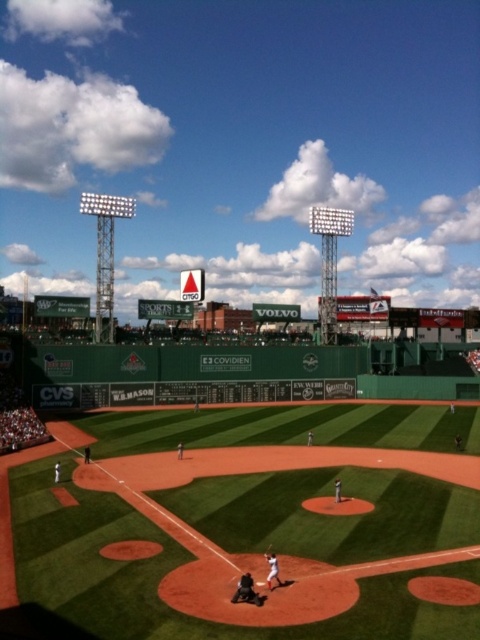
Can you confirm if dark gray fabric catcher at lower center is bigger than white uniform bat at center?

Correct, dark gray fabric catcher at lower center is larger in size than white uniform bat at center.

Is dark gray fabric catcher at lower center above white uniform bat at center?

Actually, dark gray fabric catcher at lower center is below white uniform bat at center.

The image size is (480, 640). I want to click on dark gray fabric catcher at lower center, so click(245, 589).

Find the location of `dark gray fabric catcher at lower center`. dark gray fabric catcher at lower center is located at coordinates (245, 589).

Which is above, white uniform bat at center or wooden bat at home plate?

Positioned higher is white uniform bat at center.

Does white uniform bat at center appear on the right side of wooden bat at home plate?

Yes, white uniform bat at center is to the right of wooden bat at home plate.

The image size is (480, 640). I want to click on white uniform bat at center, so click(272, 570).

Who is higher up, green turf field at center or wooden bat at home plate?

green turf field at center is higher up.

Does green turf field at center have a larger size compared to wooden bat at home plate?

Indeed, green turf field at center has a larger size compared to wooden bat at home plate.

Find the location of a particular element. The width and height of the screenshot is (480, 640). green turf field at center is located at coordinates [247, 531].

Locate an element on the screen. green turf field at center is located at coordinates (247, 531).